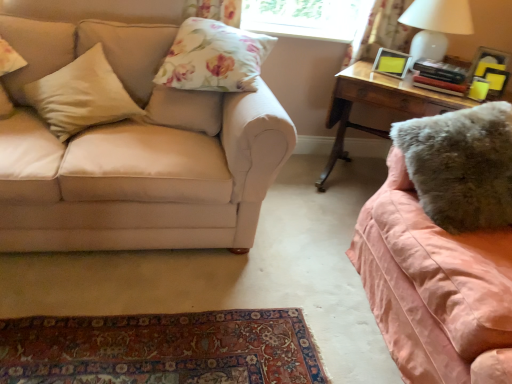
Identify the location of free point in front of matte yellow picture frame at upper right. The width and height of the screenshot is (512, 384). (399, 82).